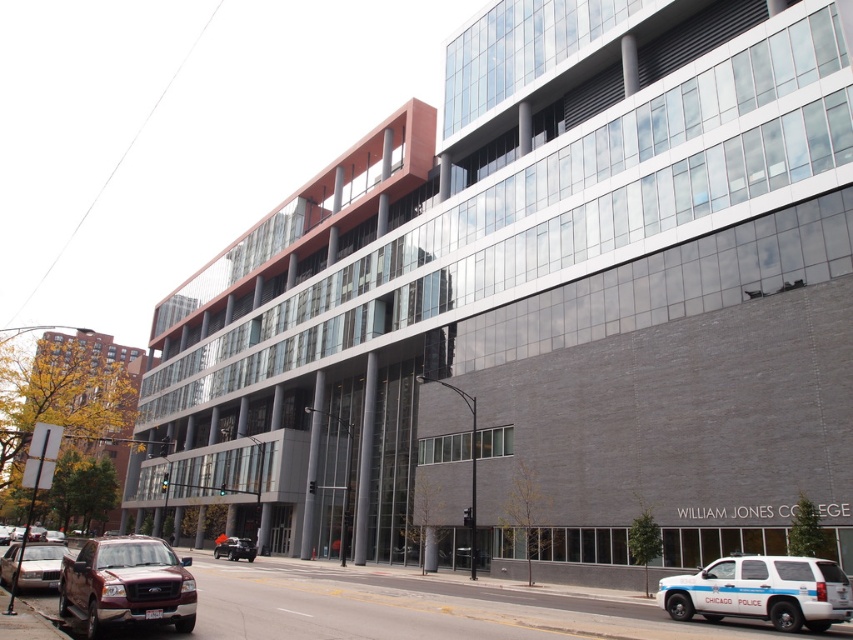
You are standing at the entrance of WILLIAM JONES COLLEGE and looking towards the parking area. You see a gold metallic sedan at lower left and a metallic silver car at center. Which car is closer to the entrance?

The metallic silver car at center is closer to the entrance because the gold metallic sedan at lower left is located above it, meaning the silver car is positioned lower and nearer to the entrance area.

You are a delivery driver approaching the entrance of WILLIAM JONES COLLEGE. You need to park your vehicle. You have a white matte suv at lower right and a matte red truck at lower left. Which vehicle is shorter and thus easier to park in the tight parking spot near the entrance?

The white matte suv at lower right is not as tall as the matte red truck at lower left, so the white matte suv at lower right is shorter and easier to park in the tight parking spot near the entrance.